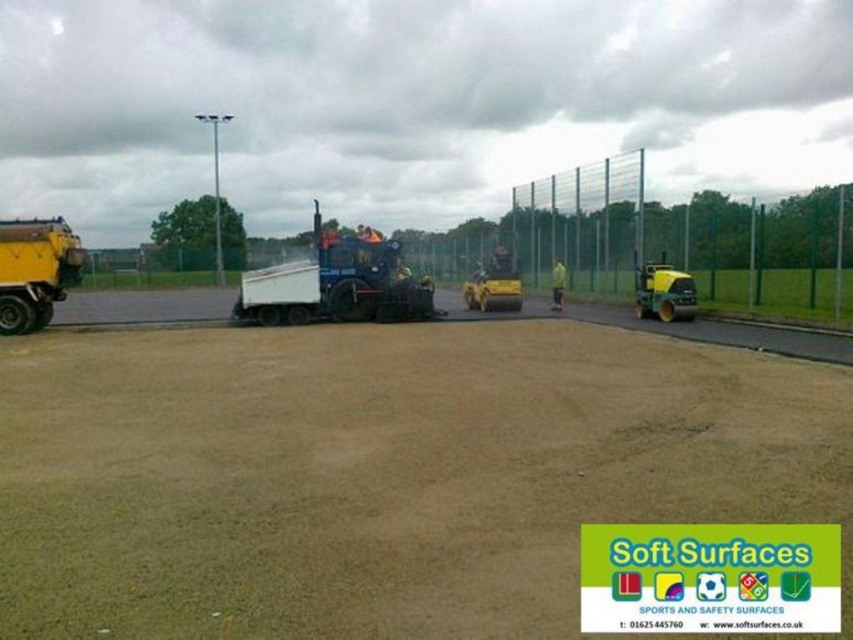
Question: Which object is farther from the camera taking this photo?

Choices:
 (A) blue rubberized asphalt spreader at center
 (B) yellow rubber truck at left
 (C) brown sandy dirt track at center

Answer: (A)

Question: Does blue rubberized asphalt spreader at center have a greater width compared to green fabric construction worker at center?

Choices:
 (A) no
 (B) yes

Answer: (B)

Question: Does yellow rubber truck at left have a lesser width compared to yellow rubber roller at right?

Choices:
 (A) no
 (B) yes

Answer: (A)

Question: Which point is closer to the camera taking this photo?

Choices:
 (A) (26, 243)
 (B) (554, 268)
 (C) (311, 259)
 (D) (556, 616)

Answer: (D)

Question: Does brown sandy dirt track at center appear on the right side of green fabric construction worker at center?

Choices:
 (A) yes
 (B) no

Answer: (B)

Question: Which point is farther to the camera?

Choices:
 (A) (306, 538)
 (B) (636, 305)

Answer: (B)